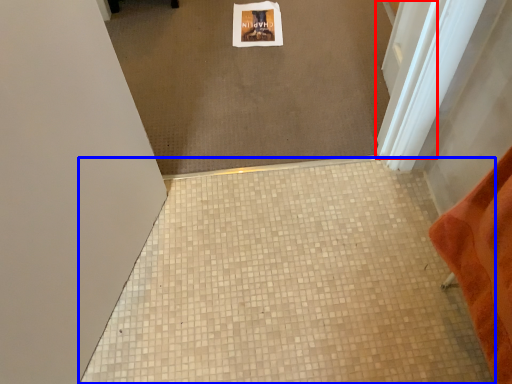
Question: Which object appears farthest to the camera in this image, screen door (highlighted by a red box) or tile (highlighted by a blue box)?

Choices:
 (A) screen door
 (B) tile

Answer: (A)